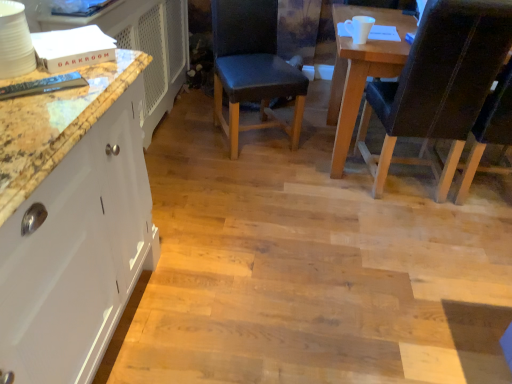
The image size is (512, 384). Identify the location of vacant area situated to the left side of leather-like black chair at right, marked as the 2th chair in a left-to-right arrangement. (314, 186).